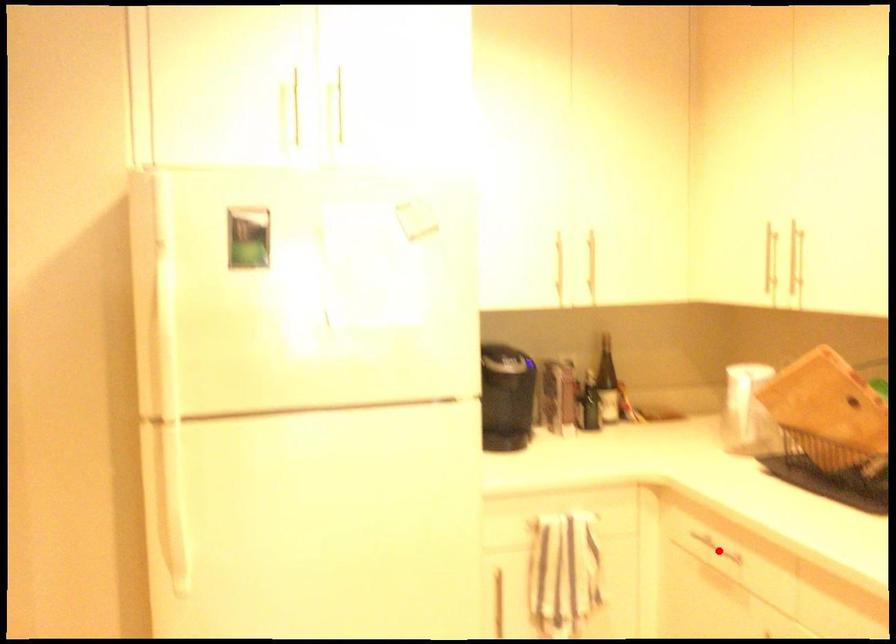
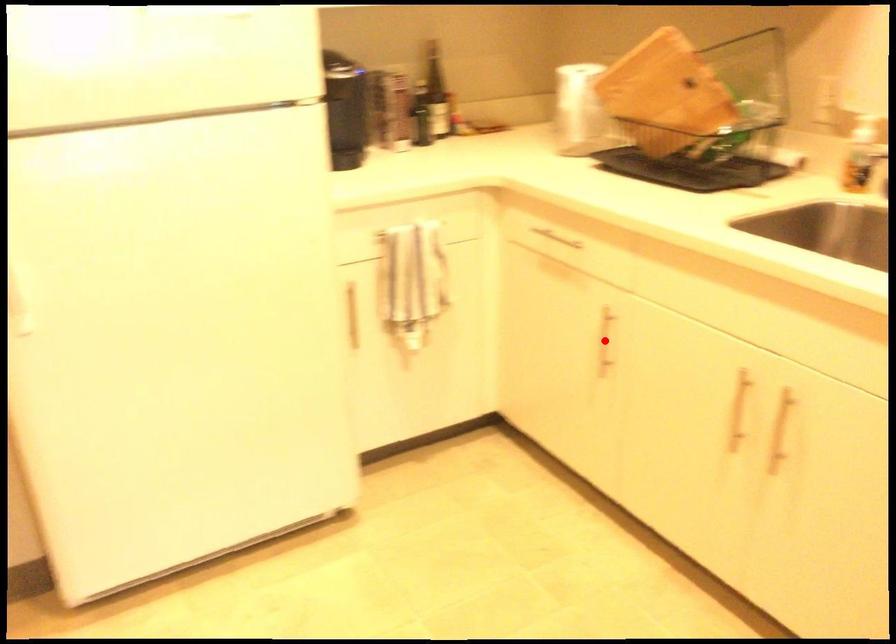
I am providing you with two images of the same scene from different viewpoints. A red point is marked on the first image and another point is marked on the second image. Is the marked point in image1 the same physical position as the marked point in image2?

No